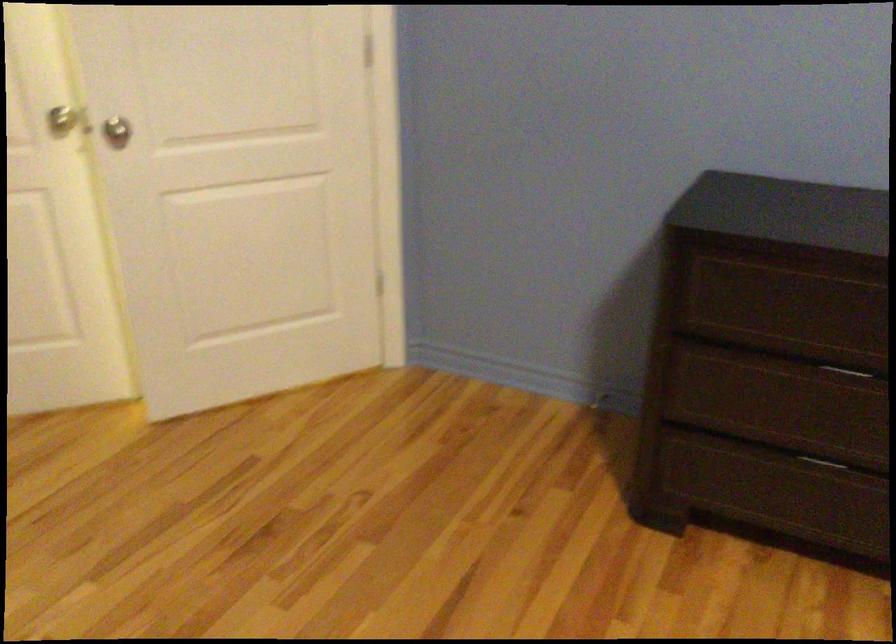
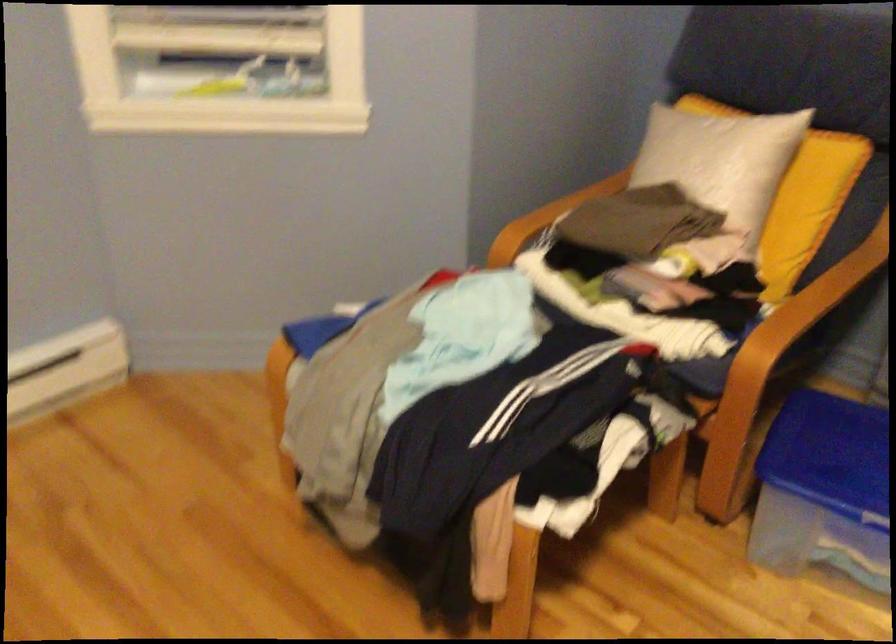
Based on the continuous images, in which direction is the camera rotating?

The camera rotated toward left-down.